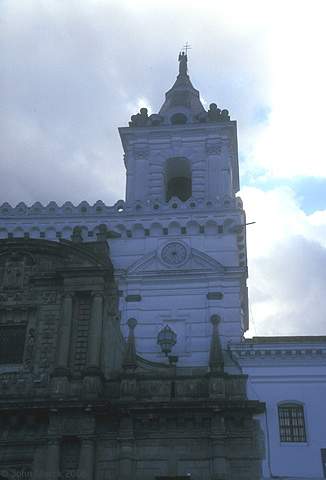
This screenshot has width=326, height=480. What are the coordinates of `light` in the screenshot? It's located at (171, 333).